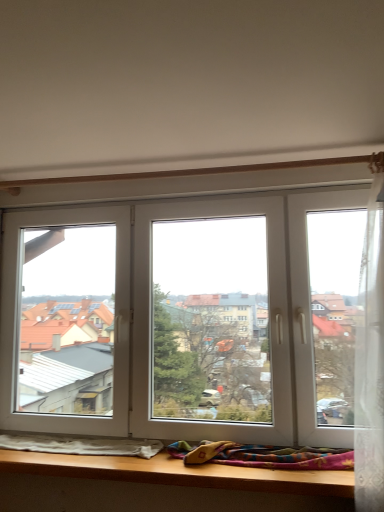
I want to click on white soft blanket at lower left, which appears as the 2th blanket when viewed from the right, so click(x=80, y=445).

What do you see at coordinates (80, 445) in the screenshot?
I see `white soft blanket at lower left, which appears as the 2th blanket when viewed from the right` at bounding box center [80, 445].

The image size is (384, 512). Find the location of `multicolored woven blanket at lower center, the 2th blanket positioned from the left`. multicolored woven blanket at lower center, the 2th blanket positioned from the left is located at coordinates (264, 456).

The width and height of the screenshot is (384, 512). Describe the element at coordinates (264, 456) in the screenshot. I see `multicolored woven blanket at lower center, the first blanket when ordered from right to left` at that location.

What is the approximate width of multicolored woven blanket at lower center, the 2th blanket positioned from the left?

14.52 centimeters.

Identify the location of white soft blanket at lower left, arranged as the first blanket when viewed from the left. (80, 445).

Is multicolored woven blanket at lower center, the 2th blanket positioned from the left, to the right of white soft blanket at lower left, arranged as the first blanket when viewed from the left, from the viewer's perspective?

Correct, you'll find multicolored woven blanket at lower center, the 2th blanket positioned from the left, to the right of white soft blanket at lower left, arranged as the first blanket when viewed from the left.

Based on the photo, which object is further away from the camera taking this photo, multicolored woven blanket at lower center, the first blanket when ordered from right to left, or white soft blanket at lower left, arranged as the first blanket when viewed from the left?

white soft blanket at lower left, arranged as the first blanket when viewed from the left, is further away from the camera.

Between point (283, 448) and point (6, 448), which one is positioned behind?

Positioned behind is point (6, 448).

From the image's perspective, would you say multicolored woven blanket at lower center, the first blanket when ordered from right to left, is shown under white soft blanket at lower left, arranged as the first blanket when viewed from the left?

No, from the image's perspective, multicolored woven blanket at lower center, the first blanket when ordered from right to left, is not beneath white soft blanket at lower left, arranged as the first blanket when viewed from the left.

From a real-world perspective, which is physically below, multicolored woven blanket at lower center, the first blanket when ordered from right to left, or white soft blanket at lower left, arranged as the first blanket when viewed from the left?

white soft blanket at lower left, arranged as the first blanket when viewed from the left, from a real-world perspective.

Is multicolored woven blanket at lower center, the first blanket when ordered from right to left, wider or thinner than white soft blanket at lower left, arranged as the first blanket when viewed from the left?

Clearly, multicolored woven blanket at lower center, the first blanket when ordered from right to left, has more width compared to white soft blanket at lower left, arranged as the first blanket when viewed from the left.

Considering the relative sizes of multicolored woven blanket at lower center, the 2th blanket positioned from the left, and white soft blanket at lower left, arranged as the first blanket when viewed from the left, in the image provided, is multicolored woven blanket at lower center, the 2th blanket positioned from the left, taller than white soft blanket at lower left, arranged as the first blanket when viewed from the left,?

Indeed, multicolored woven blanket at lower center, the 2th blanket positioned from the left, has a greater height compared to white soft blanket at lower left, arranged as the first blanket when viewed from the left.

Does multicolored woven blanket at lower center, the 2th blanket positioned from the left, have a larger size compared to white soft blanket at lower left, which appears as the 2th blanket when viewed from the right?

Correct, multicolored woven blanket at lower center, the 2th blanket positioned from the left, is larger in size than white soft blanket at lower left, which appears as the 2th blanket when viewed from the right.

Do you think multicolored woven blanket at lower center, the 2th blanket positioned from the left, is within white soft blanket at lower left, arranged as the first blanket when viewed from the left, or outside of it?

multicolored woven blanket at lower center, the 2th blanket positioned from the left, is located beyond the bounds of white soft blanket at lower left, arranged as the first blanket when viewed from the left.

Does multicolored woven blanket at lower center, the first blanket when ordered from right to left, touch white soft blanket at lower left, which appears as the 2th blanket when viewed from the right?

No, multicolored woven blanket at lower center, the first blanket when ordered from right to left, is not touching white soft blanket at lower left, which appears as the 2th blanket when viewed from the right.

Is multicolored woven blanket at lower center, the first blanket when ordered from right to left, looking in the opposite direction of white soft blanket at lower left, arranged as the first blanket when viewed from the left?

No.

Can you tell me how much multicolored woven blanket at lower center, the first blanket when ordered from right to left, and white soft blanket at lower left, which appears as the 2th blanket when viewed from the right, differ in facing direction?

0.00204 degrees.

In order to click on blanket that is under the multicolored woven blanket at lower center, the first blanket when ordered from right to left (from a real-world perspective) in this screenshot , I will do `click(80, 445)`.

Considering the relative positions of white soft blanket at lower left, arranged as the first blanket when viewed from the left, and multicolored woven blanket at lower center, the first blanket when ordered from right to left, in the image provided, is white soft blanket at lower left, arranged as the first blanket when viewed from the left, to the left or to the right of multicolored woven blanket at lower center, the first blanket when ordered from right to left,?

white soft blanket at lower left, arranged as the first blanket when viewed from the left, is to the left of multicolored woven blanket at lower center, the first blanket when ordered from right to left.

Which object is closer to the camera taking this photo, white soft blanket at lower left, which appears as the 2th blanket when viewed from the right, or multicolored woven blanket at lower center, the 2th blanket positioned from the left?

multicolored woven blanket at lower center, the 2th blanket positioned from the left, is closer to the camera.

Is point (36, 435) closer or farther from the camera than point (299, 453)?

Point (36, 435) is farther from the camera than point (299, 453).

From the image's perspective, is white soft blanket at lower left, which appears as the 2th blanket when viewed from the right, on multicolored woven blanket at lower center, the 2th blanket positioned from the left?

Incorrect, from the image's perspective, white soft blanket at lower left, which appears as the 2th blanket when viewed from the right, is lower than multicolored woven blanket at lower center, the 2th blanket positioned from the left.

From a real-world perspective, is white soft blanket at lower left, arranged as the first blanket when viewed from the left, positioned under multicolored woven blanket at lower center, the first blanket when ordered from right to left, based on gravity?

Yes.

Consider the image. Is white soft blanket at lower left, which appears as the 2th blanket when viewed from the right, thinner than multicolored woven blanket at lower center, the first blanket when ordered from right to left?

Yes, white soft blanket at lower left, which appears as the 2th blanket when viewed from the right, is thinner than multicolored woven blanket at lower center, the first blanket when ordered from right to left.

Is white soft blanket at lower left, which appears as the 2th blanket when viewed from the right, shorter than multicolored woven blanket at lower center, the first blanket when ordered from right to left?

Correct, white soft blanket at lower left, which appears as the 2th blanket when viewed from the right, is not as tall as multicolored woven blanket at lower center, the first blanket when ordered from right to left.

Is white soft blanket at lower left, arranged as the first blanket when viewed from the left, smaller than multicolored woven blanket at lower center, the first blanket when ordered from right to left?

Yes.

Choose the correct answer: Is white soft blanket at lower left, which appears as the 2th blanket when viewed from the right, inside multicolored woven blanket at lower center, the 2th blanket positioned from the left, or outside it?

white soft blanket at lower left, which appears as the 2th blanket when viewed from the right, is spatially situated outside multicolored woven blanket at lower center, the 2th blanket positioned from the left.

Would you say white soft blanket at lower left, arranged as the first blanket when viewed from the left, is a long distance from multicolored woven blanket at lower center, the 2th blanket positioned from the left?

No.

Is white soft blanket at lower left, arranged as the first blanket when viewed from the left, aimed at multicolored woven blanket at lower center, the first blanket when ordered from right to left?

No, white soft blanket at lower left, arranged as the first blanket when viewed from the left, is not turned towards multicolored woven blanket at lower center, the first blanket when ordered from right to left.

How different are the orientations of white soft blanket at lower left, arranged as the first blanket when viewed from the left, and multicolored woven blanket at lower center, the first blanket when ordered from right to left, in degrees?

The angular difference between white soft blanket at lower left, arranged as the first blanket when viewed from the left, and multicolored woven blanket at lower center, the first blanket when ordered from right to left, is 0.00204 degrees.

This screenshot has width=384, height=512. I want to click on blanket lying above the white soft blanket at lower left, which appears as the 2th blanket when viewed from the right (from the image's perspective), so click(264, 456).

This screenshot has width=384, height=512. I want to click on blanket located below the multicolored woven blanket at lower center, the 2th blanket positioned from the left (from the image's perspective), so click(80, 445).

The height and width of the screenshot is (512, 384). I want to click on blanket above the white soft blanket at lower left, which appears as the 2th blanket when viewed from the right (from the image's perspective), so click(x=264, y=456).